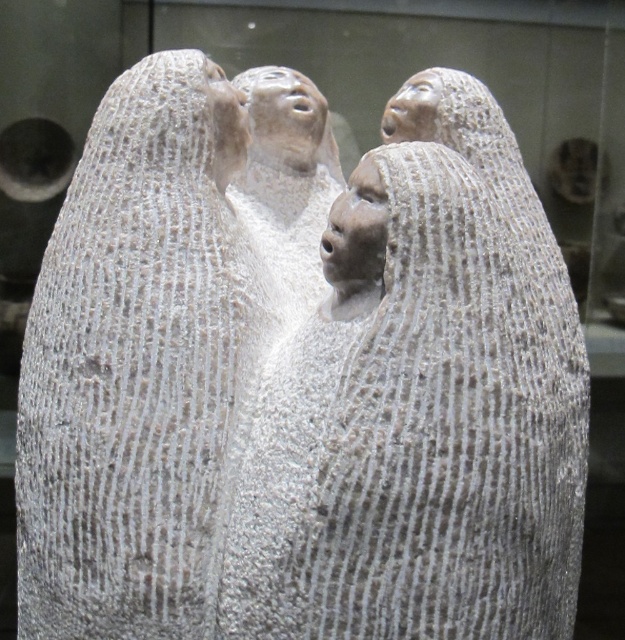
From the picture: Is gray textured stone figures at center to the right of gray textured stone head at upper center from the viewer's perspective?

Indeed, gray textured stone figures at center is positioned on the right side of gray textured stone head at upper center.

Is point (285, 488) closer to viewer compared to point (450, 140)?

Yes, point (285, 488) is in front of point (450, 140).

Locate an element on the screen. The width and height of the screenshot is (625, 640). gray textured stone figures at center is located at coordinates (420, 406).

Consider the image. Can you confirm if gray textured stone statue at upper center is positioned to the left of gray textured stone head at center?

Yes, gray textured stone statue at upper center is to the left of gray textured stone head at center.

Measure the distance between gray textured stone statue at upper center and camera.

gray textured stone statue at upper center is 5.35 feet from camera.

Where is `gray textured stone statue at upper center`? gray textured stone statue at upper center is located at coordinates (140, 365).

Between point (22, 570) and point (431, 83), which one is positioned behind?

Point (431, 83)

Is point (266, 300) positioned in front of point (429, 88)?

Yes, point (266, 300) is in front of point (429, 88).

This screenshot has width=625, height=640. I want to click on gray textured stone statue at upper center, so click(x=140, y=365).

Locate an element on the screen. The width and height of the screenshot is (625, 640). gray textured stone statue at upper center is located at coordinates (140, 365).